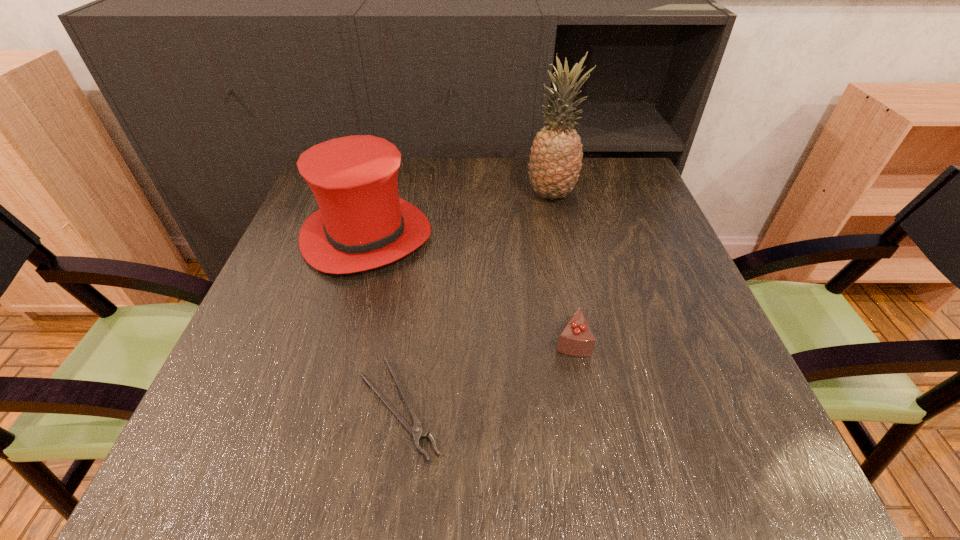
What are the coordinates of `the tallest object` in the screenshot? It's located at (555, 162).

This screenshot has width=960, height=540. What are the coordinates of `the second tallest object` in the screenshot? It's located at (362, 223).

Where is `the second nearest object`? the second nearest object is located at coordinates (576, 339).

What are the coordinates of `chocolate cake` in the screenshot? It's located at (576, 339).

Locate an element on the screen. The width and height of the screenshot is (960, 540). tongs is located at coordinates (416, 431).

At what (x,y) coordinates should I click in order to perform the action: click on the nearest object. Please return your answer as a coordinate pair (x, y). This screenshot has width=960, height=540. Looking at the image, I should click on (416, 431).

Where is `free region located on the left of the pineapple`? free region located on the left of the pineapple is located at coordinates (484, 195).

This screenshot has height=540, width=960. I want to click on vacant space situated on the right of the hat, so click(x=560, y=236).

This screenshot has height=540, width=960. Find the location of `vacant space located 0.250m on the back of the third tallest object`. vacant space located 0.250m on the back of the third tallest object is located at coordinates (553, 240).

You are a GUI agent. You are given a task and a screenshot of the screen. Output one action in this format:
    pyautogui.click(x=<x>, y=<y>)
    Task: Click on the blank space located 0.180m on the left of the nearest object
    This screenshot has height=540, width=960.
    Given the screenshot: What is the action you would take?
    pyautogui.click(x=243, y=409)